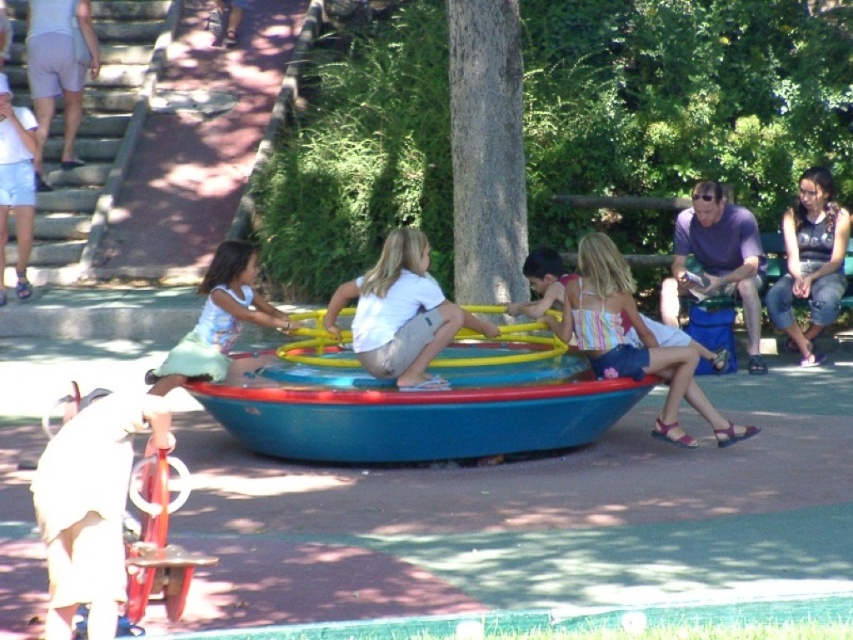
Question: Which object is the farthest from the striped fabric dress at center?

Choices:
 (A) light green fabric dress at center
 (B) denim shorts at lower right
 (C) blue plastic boat at center

Answer: (B)

Question: Can you confirm if striped fabric dress at center is thinner than light green fabric dress at center?

Choices:
 (A) no
 (B) yes

Answer: (A)

Question: Estimate the real-world distances between objects in this image. Which object is farther from the light green fabric dress at center?

Choices:
 (A) striped fabric dress at center
 (B) white cotton shirt at center

Answer: (A)

Question: Can you confirm if white cotton shirt at center is positioned above light green fabric dress at center?

Choices:
 (A) no
 (B) yes

Answer: (B)

Question: In this image, where is white cotton shirt at center located relative to striped fabric dress at center?

Choices:
 (A) right
 (B) left

Answer: (B)

Question: Which object appears closest to the camera in this image?

Choices:
 (A) striped fabric dress at center
 (B) denim shorts at lower right

Answer: (A)